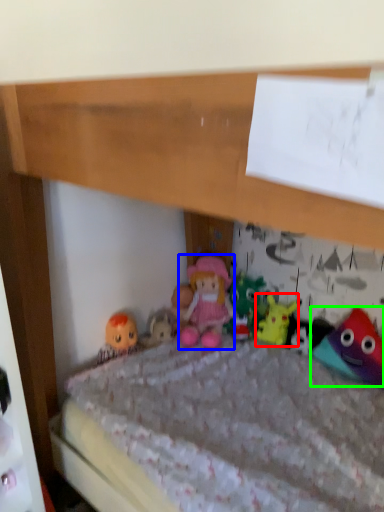
Question: Which is farther away from toy (highlighted by a red box)? person (highlighted by a blue box) or toy (highlighted by a green box)?

Choices:
 (A) person
 (B) toy

Answer: (B)